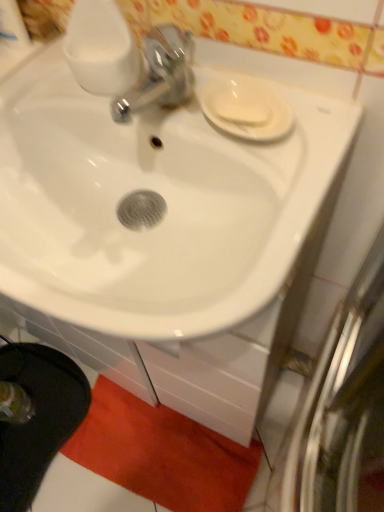
What do you see at coordinates (239, 104) in the screenshot? I see `white matte soap at upper right` at bounding box center [239, 104].

What do you see at coordinates (246, 109) in the screenshot?
I see `white glossy saucer at upper right` at bounding box center [246, 109].

Identify the location of white glossy sink at center. (163, 198).

The image size is (384, 512). In order to click on sink below the white matte soap at upper right (from a real-world perspective) in this screenshot , I will do coord(163,198).

Is white matte soap at upper right in front of white glossy sink at center?

No, white matte soap at upper right is further to the viewer.

Based on the photo, can you confirm if white matte soap at upper right is thinner than white glossy sink at center?

Correct, the width of white matte soap at upper right is less than that of white glossy sink at center.

Which of these two, white matte soap at upper right or white glossy sink at center, stands taller?

Standing taller between the two is white glossy sink at center.

Which object is thinner, white glossy saucer at upper right or white matte soap at upper right?

Thinner between the two is white matte soap at upper right.

Does white glossy saucer at upper right come behind white matte soap at upper right?

No, it is in front of white matte soap at upper right.

From a real-world perspective, is white glossy saucer at upper right above or below white matte soap at upper right?

white glossy saucer at upper right is situated lower than white matte soap at upper right in the real world.

Is white glossy sink at center positioned far away from white matte soap at upper right?

white glossy sink at center is near white matte soap at upper right, not far away.

Considering the sizes of objects white glossy sink at center and white matte soap at upper right in the image provided, who is bigger, white glossy sink at center or white matte soap at upper right?

white glossy sink at center.

How different are the orientations of white glossy sink at center and white matte soap at upper right in degrees?

They differ by 8.56 degrees in their facing directions.

In the scene shown: Is white glossy sink at center oriented towards white matte soap at upper right?

No, white glossy sink at center is not facing towards white matte soap at upper right.

How much distance is there between orange plush bath mat at lower center and white glossy sink at center?

30.39 inches.

Is orange plush bath mat at lower center not near white glossy sink at center?

They are positioned close to each other.

Is white glossy sink at center completely or partially inside orange plush bath mat at lower center?

No, white glossy sink at center is not inside orange plush bath mat at lower center.

From the picture: What's the angular difference between orange plush bath mat at lower center and white glossy sink at center's facing directions?

orange plush bath mat at lower center and white glossy sink at center are facing 4.84 degrees away from each other.

Considering the relative sizes of white matte soap at upper right and orange plush bath mat at lower center in the image provided, is white matte soap at upper right thinner than orange plush bath mat at lower center?

Yes.

How much distance is there between white matte soap at upper right and orange plush bath mat at lower center?

A distance of 35.86 inches exists between white matte soap at upper right and orange plush bath mat at lower center.

From a real-world perspective, relative to orange plush bath mat at lower center, is white matte soap at upper right vertically above or below?

white matte soap at upper right is above orange plush bath mat at lower center.

Considering the points (260, 118) and (111, 384), which point is behind, point (260, 118) or point (111, 384)?

The point (111, 384) is more distant.

How different are the orientations of white glossy sink at center and white glossy saucer at upper right in degrees?

18.1 degrees separate the facing orientations of white glossy sink at center and white glossy saucer at upper right.

From the picture: Can we say white glossy sink at center lies outside white glossy saucer at upper right?

Yes.

Considering the relative sizes of white glossy sink at center and white glossy saucer at upper right in the image provided, is white glossy sink at center thinner than white glossy saucer at upper right?

In fact, white glossy sink at center might be wider than white glossy saucer at upper right.

Consider the image. Considering the relative positions of white matte soap at upper right and white glossy saucer at upper right in the image provided, is white matte soap at upper right to the left of white glossy saucer at upper right from the viewer's perspective?

Incorrect, white matte soap at upper right is not on the left side of white glossy saucer at upper right.

Is white matte soap at upper right bigger than white glossy saucer at upper right?

Incorrect, white matte soap at upper right is not larger than white glossy saucer at upper right.

Considering the points (253, 104) and (270, 126), which point is behind, point (253, 104) or point (270, 126)?

The point (253, 104) is behind.

The width and height of the screenshot is (384, 512). In order to click on sink that appears below the white matte soap at upper right (from a real-world perspective) in this screenshot , I will do `click(163, 198)`.

Image resolution: width=384 pixels, height=512 pixels. In order to click on saucer that appears below the white matte soap at upper right (from the image's perspective) in this screenshot , I will do `click(246, 109)`.

When comparing their distances from white matte soap at upper right, does orange plush bath mat at lower center or white glossy saucer at upper right seem further?

Based on the image, orange plush bath mat at lower center appears to be further to white matte soap at upper right.

Which object lies nearer to the anchor point white matte soap at upper right, white glossy sink at center or white glossy saucer at upper right?

The object closer to white matte soap at upper right is white glossy saucer at upper right.

When comparing their distances from orange plush bath mat at lower center, does white glossy saucer at upper right or white matte soap at upper right seem closer?

Based on the image, white glossy saucer at upper right appears to be nearer to orange plush bath mat at lower center.

When comparing their distances from white glossy sink at center, does orange plush bath mat at lower center or white glossy saucer at upper right seem closer?

white glossy saucer at upper right.

Considering their positions, is white glossy sink at center positioned closer to orange plush bath mat at lower center than white glossy saucer at upper right?

white glossy sink at center.

Considering their positions, is white matte soap at upper right positioned closer to white glossy saucer at upper right than orange plush bath mat at lower center?

The object closer to white glossy saucer at upper right is white matte soap at upper right.

Considering their positions, is white glossy saucer at upper right positioned further to white matte soap at upper right than orange plush bath mat at lower center?

Among the two, orange plush bath mat at lower center is located further to white matte soap at upper right.

Based on their spatial positions, is white glossy sink at center or white matte soap at upper right closer to white glossy saucer at upper right?

white matte soap at upper right is closer to white glossy saucer at upper right.

At what (x,y) coordinates should I click in order to perform the action: click on saucer between white glossy sink at center and white matte soap at upper right in the horizontal direction. Please return your answer as a coordinate pair (x, y). The width and height of the screenshot is (384, 512). Looking at the image, I should click on (246, 109).

Locate an element on the screen. saucer that lies between white matte soap at upper right and orange plush bath mat at lower center from top to bottom is located at coordinates (246, 109).

The image size is (384, 512). I want to click on sink between white glossy saucer at upper right and orange plush bath mat at lower center vertically, so click(x=163, y=198).

I want to click on sink that lies between white matte soap at upper right and orange plush bath mat at lower center from top to bottom, so click(163, 198).